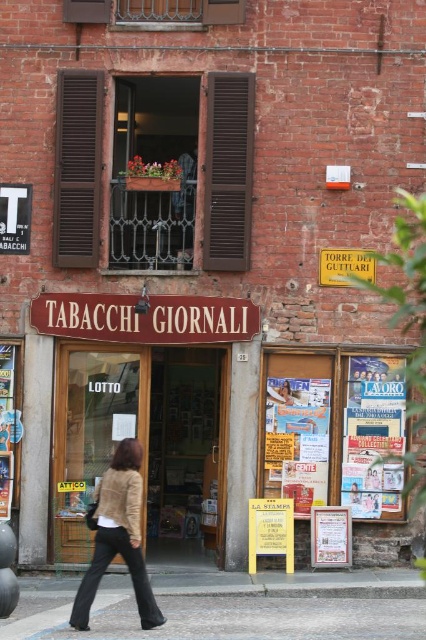
You are a delivery person trying to park your bike. You see the gray concrete pavement at lower center and the beige fuzzy jacket at lower left. Which area is larger and suitable for parking?

The gray concrete pavement at lower center is bigger than the beige fuzzy jacket at lower left, so it is suitable for parking.

You are standing in front of the shop and want to step onto the gray concrete pavement at lower center. Where should you move from the beige fuzzy jacket at lower left?

The gray concrete pavement at lower center is to the right of the beige fuzzy jacket at lower left, so you should move to the right from the beige fuzzy jacket at lower left to reach it.

You are standing in front of the shop and want to place a small potted plant on the gray concrete pavement at lower center. However, you notice the beige fuzzy jacket at lower left nearby. Which object is closer to you where you can place the plant?

The gray concrete pavement at lower center is closer to the viewer than the beige fuzzy jacket at lower left, so you can place the plant there.